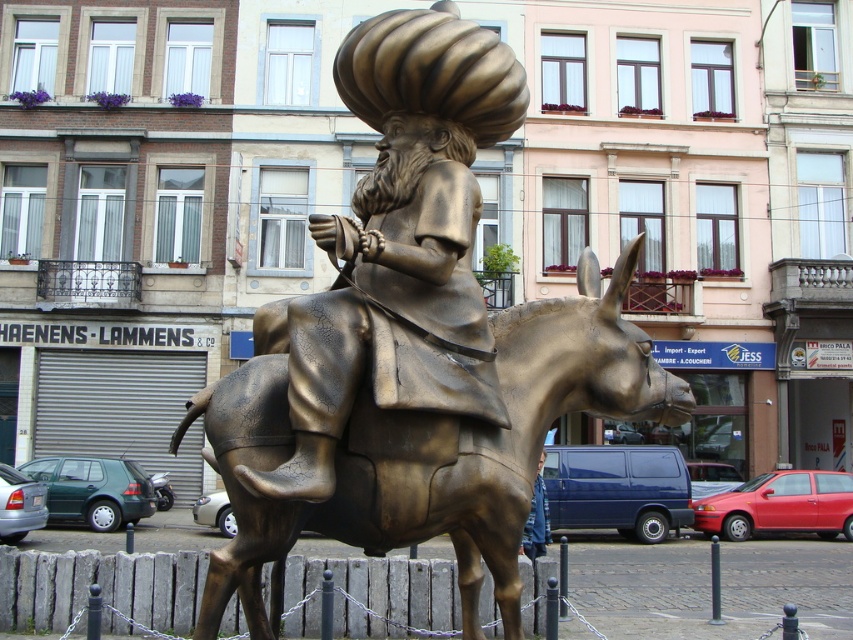
Question: Where is bronze statue at center located in relation to bronze textured horse at center in the image?

Choices:
 (A) above
 (B) below

Answer: (A)

Question: Which of the following is the closest to the observer?

Choices:
 (A) (303, 513)
 (B) (473, 24)

Answer: (A)

Question: Can you confirm if bronze statue at center is positioned above bronze textured horse at center?

Choices:
 (A) yes
 (B) no

Answer: (A)

Question: Is bronze statue at center positioned behind bronze textured horse at center?

Choices:
 (A) no
 (B) yes

Answer: (A)